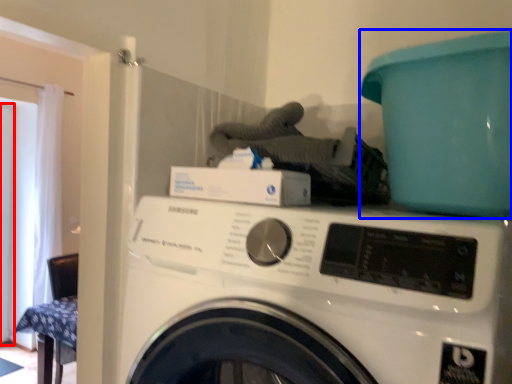
Question: Among these objects, which one is nearest to the camera, screen door (highlighted by a red box) or teal (highlighted by a blue box)?

Choices:
 (A) screen door
 (B) teal

Answer: (B)